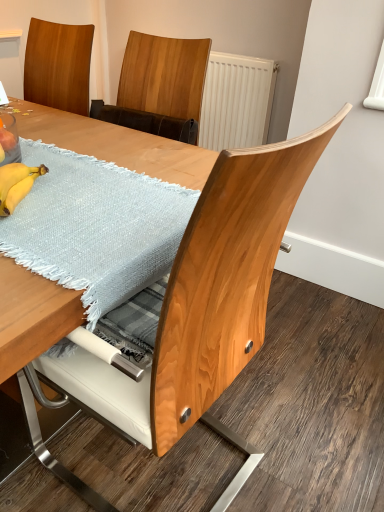
Question: From a real-world perspective, is yellow matte bananas at lower left above or below wooden table at center, the 1th table in the bottom-to-top sequence?

Choices:
 (A) above
 (B) below

Answer: (A)

Question: Is yellow matte bananas at lower left inside or outside of wooden table at center, the 1th table in the bottom-to-top sequence?

Choices:
 (A) inside
 (B) outside

Answer: (A)

Question: Considering the real-world distances, which object is closest to the yellow matte bananas at lower left?

Choices:
 (A) light blue woven placemat at upper left, acting as the 1th table starting from the top
 (B) wooden table at center, the 1th table in the bottom-to-top sequence

Answer: (A)

Question: Which object is positioned farthest from the light blue woven placemat at upper left, positioned as the 2th table in bottom-to-top order?

Choices:
 (A) wooden table at center, the second table when ordered from top to bottom
 (B) yellow matte bananas at lower left

Answer: (A)